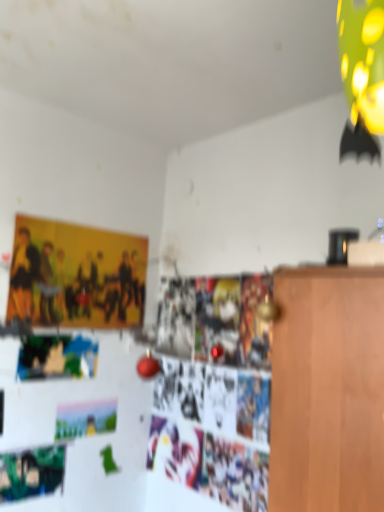
Question: Is green matte poster at lower left not close to pastel matte postcard at lower left?

Choices:
 (A) yes
 (B) no

Answer: (B)

Question: Is green matte poster at lower left to the right of pastel matte postcard at lower left from the viewer's perspective?

Choices:
 (A) yes
 (B) no

Answer: (B)

Question: Is green matte poster at lower left looking in the opposite direction of pastel matte postcard at lower left?

Choices:
 (A) no
 (B) yes

Answer: (A)

Question: Could you tell me if green matte poster at lower left is facing pastel matte postcard at lower left?

Choices:
 (A) no
 (B) yes

Answer: (A)

Question: From a real-world perspective, does green matte poster at lower left sit lower than pastel matte postcard at lower left?

Choices:
 (A) yes
 (B) no

Answer: (A)

Question: Considering the relative sizes of green matte poster at lower left and pastel matte postcard at lower left in the image provided, is green matte poster at lower left shorter than pastel matte postcard at lower left?

Choices:
 (A) no
 (B) yes

Answer: (A)

Question: Is matte yellow poster at upper left aimed at pastel matte postcard at lower left?

Choices:
 (A) no
 (B) yes

Answer: (A)

Question: Is matte yellow poster at upper left far from pastel matte postcard at lower left?

Choices:
 (A) no
 (B) yes

Answer: (A)

Question: Are matte yellow poster at upper left and pastel matte postcard at lower left making contact?

Choices:
 (A) yes
 (B) no

Answer: (B)

Question: Is matte yellow poster at upper left at the right side of pastel matte postcard at lower left?

Choices:
 (A) no
 (B) yes

Answer: (A)

Question: From a real-world perspective, is matte yellow poster at upper left beneath pastel matte postcard at lower left?

Choices:
 (A) yes
 (B) no

Answer: (B)

Question: Considering the relative sizes of matte yellow poster at upper left and pastel matte postcard at lower left in the image provided, is matte yellow poster at upper left shorter than pastel matte postcard at lower left?

Choices:
 (A) yes
 (B) no

Answer: (B)

Question: Considering the relative sizes of pastel matte postcard at lower left and green matte poster at lower left in the image provided, is pastel matte postcard at lower left wider than green matte poster at lower left?

Choices:
 (A) no
 (B) yes

Answer: (B)